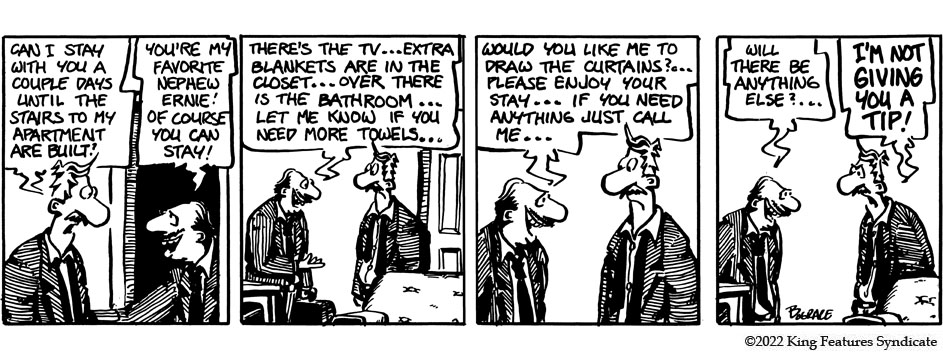
Locate an element on the screen. The image size is (943, 360). panel is located at coordinates (124, 218), (331, 211), (497, 165), (750, 143).